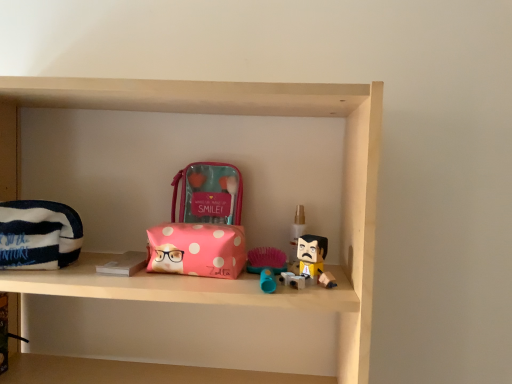
Locate an element on the screen. striped fabric pouch at left, marked as the 2th pouch in a right-to-left arrangement is located at coordinates (38, 235).

Where is `pink polka dot fabric pouch at center`? pink polka dot fabric pouch at center is located at coordinates (197, 249).

Is pink polka dot fabric pouch at center beside pink polka dot pouch at center, acting as the 2th pouch starting from the bottom?

pink polka dot fabric pouch at center is not next to pink polka dot pouch at center, acting as the 2th pouch starting from the bottom, and they're not touching.

Between pink polka dot fabric pouch at center and pink polka dot pouch at center, which appears as the second pouch when viewed from the front, which one appears on the right side from the viewer's perspective?

pink polka dot pouch at center, which appears as the second pouch when viewed from the front, is more to the right.

Considering their positions, is pink polka dot fabric pouch at center located in front of or behind pink polka dot pouch at center, which is the 2th pouch in left-to-right order?

pink polka dot fabric pouch at center is in front of pink polka dot pouch at center, which is the 2th pouch in left-to-right order.

From the image's perspective, is pink polka dot fabric pouch at center positioned above or below translucent plastic spray bottle at center?

From the image's perspective, pink polka dot fabric pouch at center appears below translucent plastic spray bottle at center.

Can you tell me how much pink polka dot fabric pouch at center and translucent plastic spray bottle at center differ in facing direction?

0.507 degrees.

Does point (151, 248) come closer to viewer compared to point (290, 261)?

Yes, point (151, 248) is closer to viewer.

In the scene shown: Which object is further away from the camera taking this photo, translucent plastic spray bottle at center or striped fabric pouch at left, which ranks as the 2th pouch in top-to-bottom order?

translucent plastic spray bottle at center is more distant.

In the scene shown: From a real-world perspective, is translucent plastic spray bottle at center located higher than striped fabric pouch at left, positioned as the second pouch in back-to-front order?

Yes, from a real-world perspective, translucent plastic spray bottle at center is over striped fabric pouch at left, positioned as the second pouch in back-to-front order

Is translucent plastic spray bottle at center smaller than striped fabric pouch at left, positioned as the second pouch in back-to-front order?

Yes, translucent plastic spray bottle at center is smaller than striped fabric pouch at left, positioned as the second pouch in back-to-front order.

Consider the image. Considering the sizes of objects striped fabric pouch at left, which ranks as the 2th pouch in top-to-bottom order, and pink polka dot pouch at center, which is the 2th pouch in left-to-right order, in the image provided, who is smaller, striped fabric pouch at left, which ranks as the 2th pouch in top-to-bottom order, or pink polka dot pouch at center, which is the 2th pouch in left-to-right order,?

pink polka dot pouch at center, which is the 2th pouch in left-to-right order.

Based on the photo, which object is wider, striped fabric pouch at left, arranged as the 1th pouch when ordered from the bottom, or pink polka dot pouch at center, which appears as the second pouch when viewed from the front?

With larger width is striped fabric pouch at left, arranged as the 1th pouch when ordered from the bottom.

Is striped fabric pouch at left, positioned as the second pouch in back-to-front order, not close to pink polka dot pouch at center, marked as the first pouch in a right-to-left arrangement?

No, there isn't a large distance between striped fabric pouch at left, positioned as the second pouch in back-to-front order, and pink polka dot pouch at center, marked as the first pouch in a right-to-left arrangement.

How different are the orientations of striped fabric pouch at left, marked as the 2th pouch in a right-to-left arrangement, and pink polka dot pouch at center, marked as the first pouch in a right-to-left arrangement, in degrees?

striped fabric pouch at left, marked as the 2th pouch in a right-to-left arrangement, and pink polka dot pouch at center, marked as the first pouch in a right-to-left arrangement, are facing 8.2 degrees away from each other.

Is there a large distance between pink polka dot fabric pouch at center and striped fabric pouch at left, positioned as the second pouch in back-to-front order?

That's not correct — pink polka dot fabric pouch at center is a little close to striped fabric pouch at left, positioned as the second pouch in back-to-front order.

What's the angular difference between pink polka dot fabric pouch at center and striped fabric pouch at left, which ranks as the 2th pouch in top-to-bottom order,'s facing directions?

pink polka dot fabric pouch at center and striped fabric pouch at left, which ranks as the 2th pouch in top-to-bottom order, are facing 13.2 degrees away from each other.

Based on their sizes in the image, would you say pink polka dot fabric pouch at center is bigger or smaller than striped fabric pouch at left, positioned as the second pouch in back-to-front order?

Considering their sizes, pink polka dot fabric pouch at center takes up less space than striped fabric pouch at left, positioned as the second pouch in back-to-front order.

Does pink polka dot pouch at center, which is the 2th pouch in left-to-right order, have a smaller size compared to translucent plastic spray bottle at center?

No, pink polka dot pouch at center, which is the 2th pouch in left-to-right order, is not smaller than translucent plastic spray bottle at center.

Consider the image. From a real-world perspective, is pink polka dot pouch at center, acting as the first pouch starting from the top, on translucent plastic spray bottle at center?

Yes.

How different are the orientations of pink polka dot pouch at center, the first pouch positioned from the back, and translucent plastic spray bottle at center in degrees?

The angle between the facing direction of pink polka dot pouch at center, the first pouch positioned from the back, and the facing direction of translucent plastic spray bottle at center is 5.54 degrees.

From the image's perspective, is pink polka dot pouch at center, which is the 2th pouch in left-to-right order, above pink polka dot fabric pouch at center?

Yes.

Considering the relative positions of pink polka dot pouch at center, marked as the first pouch in a right-to-left arrangement, and pink polka dot fabric pouch at center in the image provided, is pink polka dot pouch at center, marked as the first pouch in a right-to-left arrangement, to the right of pink polka dot fabric pouch at center from the viewer's perspective?

Correct, you'll find pink polka dot pouch at center, marked as the first pouch in a right-to-left arrangement, to the right of pink polka dot fabric pouch at center.

From a real-world perspective, count 2nd pouchs upward from the pink polka dot fabric pouch at center and point to it. Please provide its 2D coordinates.

[(209, 193)]

Is there a large distance between pink polka dot pouch at center, acting as the 2th pouch starting from the bottom, and pink polka dot fabric pouch at center?

No, pink polka dot pouch at center, acting as the 2th pouch starting from the bottom, is not far away from pink polka dot fabric pouch at center.

You are a GUI agent. You are given a task and a screenshot of the screen. Output one action in this format:
    pyautogui.click(x=<x>, y=<y>)
    Task: Click on the pouch that is the 2nd one above the pink polka dot fabric pouch at center (from a real-world perspective)
    The width and height of the screenshot is (512, 384).
    Given the screenshot: What is the action you would take?
    pyautogui.click(x=209, y=193)

In order to click on package lying below the translucent plastic spray bottle at center (from the image's perspective) in this screenshot , I will do `click(197, 249)`.

From the image, which object appears to be farther from pink polka dot fabric pouch at center, striped fabric pouch at left, marked as the 2th pouch in a right-to-left arrangement, or pink polka dot pouch at center, the first pouch positioned from the back?

Based on the image, striped fabric pouch at left, marked as the 2th pouch in a right-to-left arrangement, appears to be further to pink polka dot fabric pouch at center.

Which object lies further to the anchor point translucent plastic spray bottle at center, pink polka dot pouch at center, the first pouch positioned from the back, or pink polka dot fabric pouch at center?

pink polka dot fabric pouch at center is positioned further to the anchor translucent plastic spray bottle at center.

Based on their spatial positions, is pink polka dot fabric pouch at center or translucent plastic spray bottle at center closer to pink polka dot pouch at center, marked as the first pouch in a right-to-left arrangement?

pink polka dot fabric pouch at center lies closer to pink polka dot pouch at center, marked as the first pouch in a right-to-left arrangement, than the other object.

Estimate the real-world distances between objects in this image. Which object is further from translucent plastic spray bottle at center, pink polka dot fabric pouch at center or pink polka dot pouch at center, acting as the first pouch starting from the top?

pink polka dot fabric pouch at center.

From the picture: Based on their spatial positions, is pink polka dot fabric pouch at center or translucent plastic spray bottle at center closer to striped fabric pouch at left, arranged as the 1th pouch when ordered from the bottom?

pink polka dot fabric pouch at center lies closer to striped fabric pouch at left, arranged as the 1th pouch when ordered from the bottom, than the other object.

Based on their spatial positions, is pink polka dot pouch at center, marked as the first pouch in a right-to-left arrangement, or striped fabric pouch at left, marked as the 1th pouch in a front-to-back arrangement, further from pink polka dot fabric pouch at center?

striped fabric pouch at left, marked as the 1th pouch in a front-to-back arrangement, is positioned further to the anchor pink polka dot fabric pouch at center.

Estimate the real-world distances between objects in this image. Which object is closer to pink polka dot pouch at center, acting as the 2th pouch starting from the bottom, translucent plastic spray bottle at center or striped fabric pouch at left, arranged as the 1th pouch when ordered from the bottom?

Among the two, translucent plastic spray bottle at center is located nearer to pink polka dot pouch at center, acting as the 2th pouch starting from the bottom.

Based on their spatial positions, is pink polka dot fabric pouch at center or striped fabric pouch at left, arranged as the 1th pouch when ordered from the bottom, closer to pink polka dot pouch at center, which appears as the second pouch when viewed from the front?

pink polka dot fabric pouch at center is closer to pink polka dot pouch at center, which appears as the second pouch when viewed from the front.

Identify the location of package between striped fabric pouch at left, marked as the 2th pouch in a right-to-left arrangement, and translucent plastic spray bottle at center. (197, 249).

The height and width of the screenshot is (384, 512). Identify the location of pouch situated between pink polka dot fabric pouch at center and translucent plastic spray bottle at center from left to right. pos(209,193).

What are the coordinates of `package between striped fabric pouch at left, which ranks as the 2th pouch in top-to-bottom order, and pink polka dot pouch at center, marked as the first pouch in a right-to-left arrangement, from left to right` in the screenshot? It's located at (197, 249).

Find the location of `pouch between striped fabric pouch at left, marked as the 2th pouch in a right-to-left arrangement, and translucent plastic spray bottle at center from left to right`. pouch between striped fabric pouch at left, marked as the 2th pouch in a right-to-left arrangement, and translucent plastic spray bottle at center from left to right is located at coordinates (209, 193).